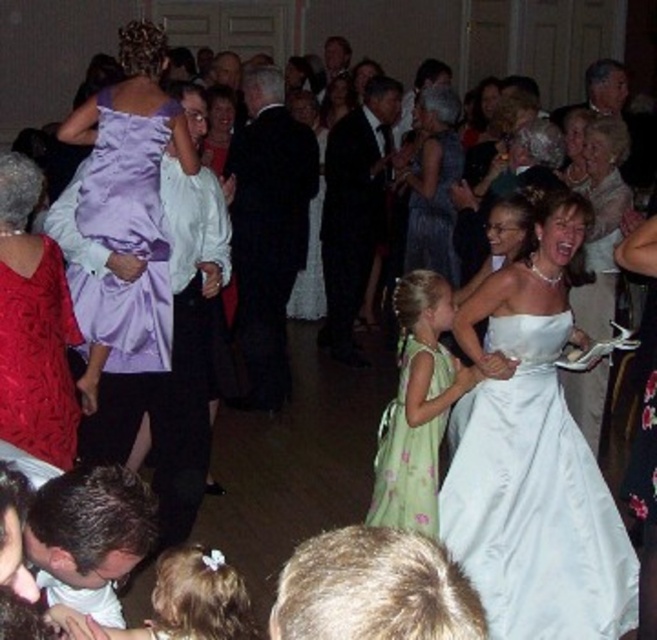
Which is above, purple satin dress at left or pastel green floral dress at lower center?

Positioned higher is purple satin dress at left.

Is point (91, 320) positioned before point (72, 632)?

No, it is not.

Identify the location of purple satin dress at left. This screenshot has height=640, width=657. (125, 237).

Can you confirm if dark suit at center is smaller than satin dress at left?

Incorrect, dark suit at center is not smaller in size than satin dress at left.

Is dark suit at center shorter than satin dress at left?

No, dark suit at center is not shorter than satin dress at left.

Between point (277, 136) and point (24, 236), which one is positioned in front?

Point (24, 236) is in front.

Identify the location of dark suit at center. This screenshot has width=657, height=640. (267, 228).

Does point (373, 532) come in front of point (5, 285)?

Yes.

Image resolution: width=657 pixels, height=640 pixels. I want to click on blonde hair at lower center, so click(373, 589).

Between point (348, 577) and point (12, 225), which one is positioned in front?

Positioned in front is point (348, 577).

The width and height of the screenshot is (657, 640). In order to click on blonde hair at lower center in this screenshot , I will do `click(373, 589)`.